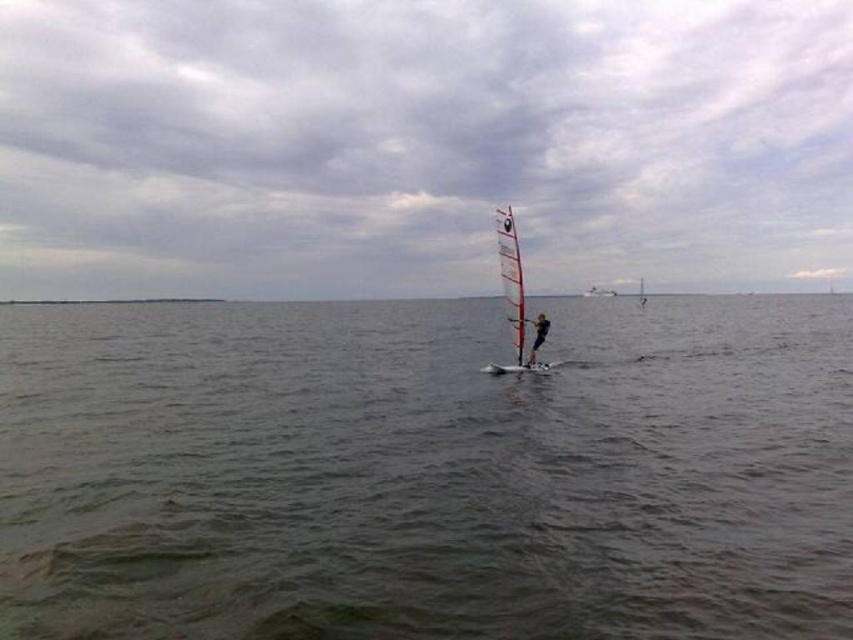
Question: Which object is closer to the camera taking this photo?

Choices:
 (A) greenish water at center
 (B) white glossy sail at center
 (C) black fabric windsurfer at center

Answer: (A)

Question: Which is nearer to the white glossy sail at center?

Choices:
 (A) greenish water at center
 (B) black fabric windsurfer at center

Answer: (B)

Question: Is greenish water at center smaller than black fabric windsurfer at center?

Choices:
 (A) yes
 (B) no

Answer: (B)

Question: Among these objects, which one is nearest to the camera?

Choices:
 (A) white glossy sail at center
 (B) greenish water at center
 (C) black fabric windsurfer at center

Answer: (B)

Question: Is greenish water at center thinner than white glossy sail at center?

Choices:
 (A) yes
 (B) no

Answer: (B)

Question: Does greenish water at center have a smaller size compared to black fabric windsurfer at center?

Choices:
 (A) yes
 (B) no

Answer: (B)